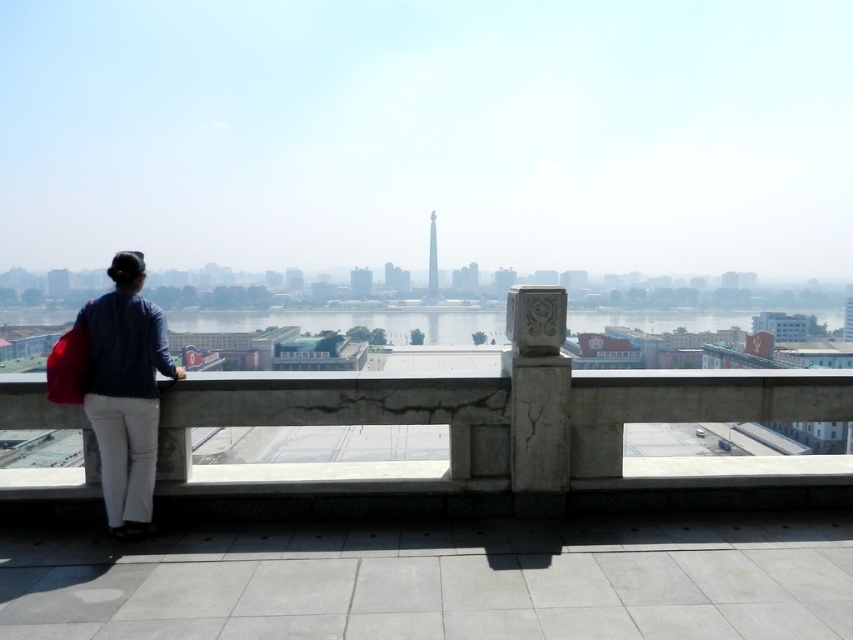
Is point (838, 401) less distant than point (128, 273)?

That is False.

What do you see at coordinates (498, 412) in the screenshot? I see `concrete at left` at bounding box center [498, 412].

The height and width of the screenshot is (640, 853). Find the location of `concrete at left`. concrete at left is located at coordinates (498, 412).